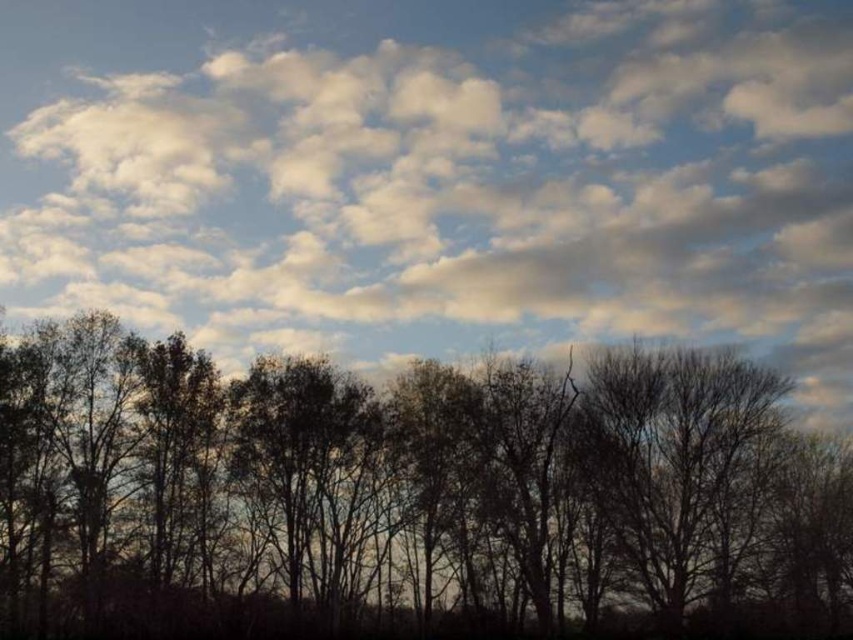
Question: Observing the image, what is the correct spatial positioning of white fluffy cloud at upper center in reference to silhouette tree at lower center?

Choices:
 (A) below
 (B) above

Answer: (B)

Question: Which of the following is the closest to the observer?

Choices:
 (A) white fluffy cloud at upper center
 (B) silhouette tree at lower center

Answer: (B)

Question: Can you confirm if white fluffy cloud at upper center is smaller than silhouette tree at lower center?

Choices:
 (A) no
 (B) yes

Answer: (A)

Question: Which object is closer to the camera taking this photo?

Choices:
 (A) white fluffy cloud at upper center
 (B) silhouette tree at lower center

Answer: (B)

Question: Among these objects, which one is farthest from the camera?

Choices:
 (A) white fluffy cloud at upper center
 (B) silhouette tree at lower center

Answer: (A)

Question: Can you confirm if white fluffy cloud at upper center is thinner than silhouette tree at lower center?

Choices:
 (A) yes
 (B) no

Answer: (B)